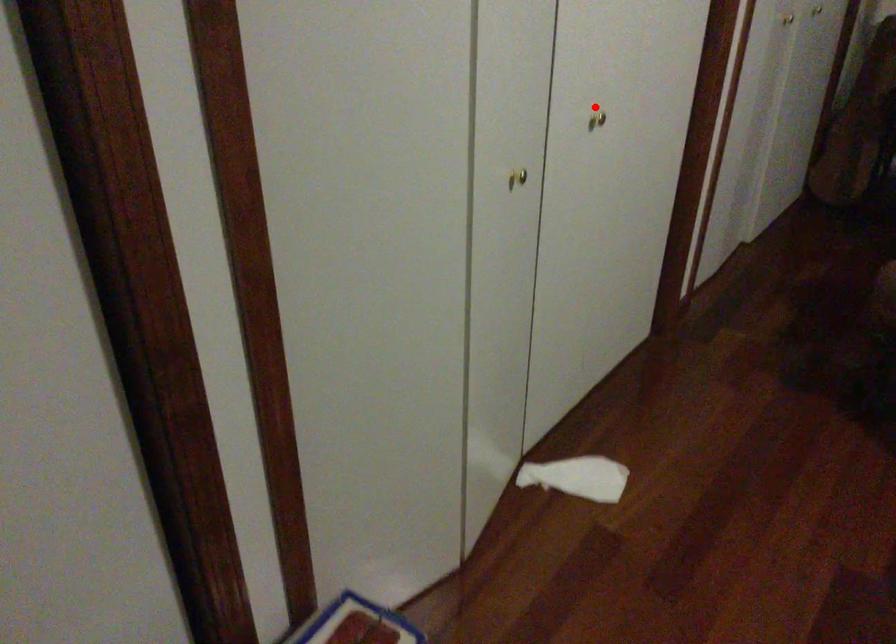
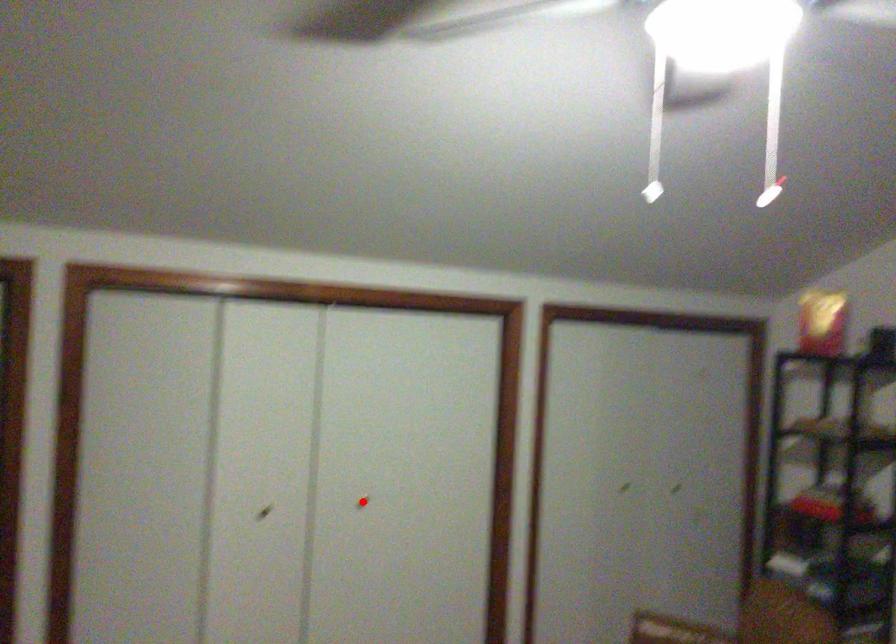
I am providing you with two images of the same scene from different viewpoints. A red point is marked on the first image and another point is marked on the second image. Is the marked point in image1 the same physical position as the marked point in image2?

Yes